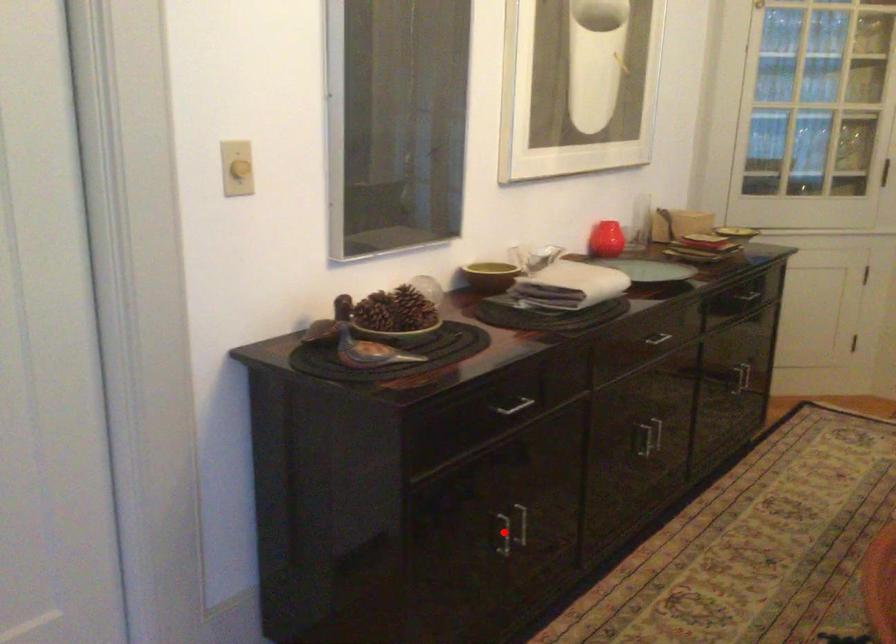
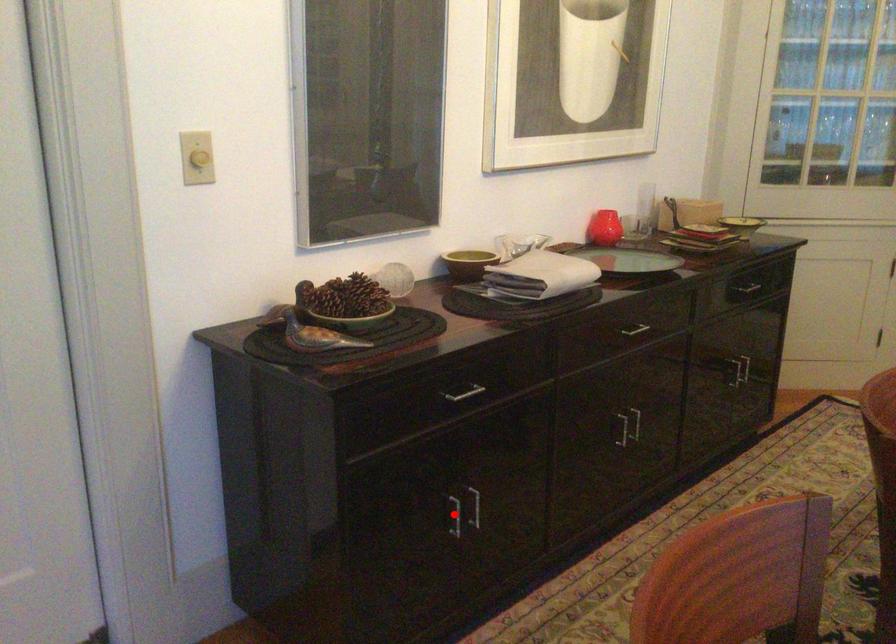
I am providing you with two images of the same scene from different viewpoints. A red point is marked on the first image and another point is marked on the second image. Does the point marked in image1 correspond to the same location as the one in image2?

Yes